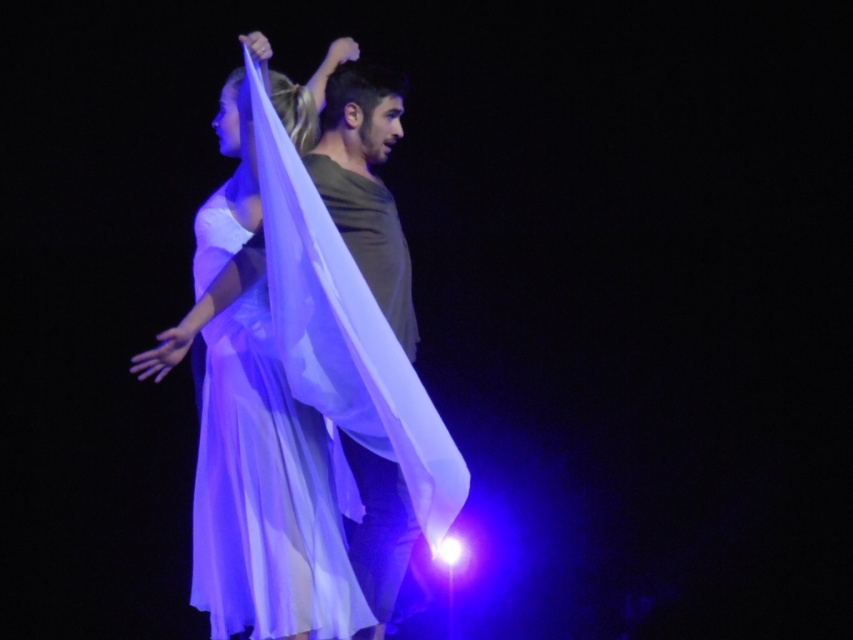
Question: In this image, where is translucent white fabric at center located relative to translucent silk dress at center?

Choices:
 (A) right
 (B) left

Answer: (A)

Question: Which point appears farthest from the camera in this image?

Choices:
 (A) (225, 616)
 (B) (256, 433)

Answer: (A)

Question: Can you confirm if translucent white fabric at center is smaller than translucent silk dress at center?

Choices:
 (A) no
 (B) yes

Answer: (A)

Question: Among these objects, which one is farthest from the camera?

Choices:
 (A) translucent white fabric at center
 (B) translucent silk dress at center

Answer: (B)

Question: Which object is farther from the camera taking this photo?

Choices:
 (A) translucent white fabric at center
 (B) translucent silk dress at center

Answer: (B)

Question: Is translucent white fabric at center bigger than translucent silk dress at center?

Choices:
 (A) yes
 (B) no

Answer: (A)